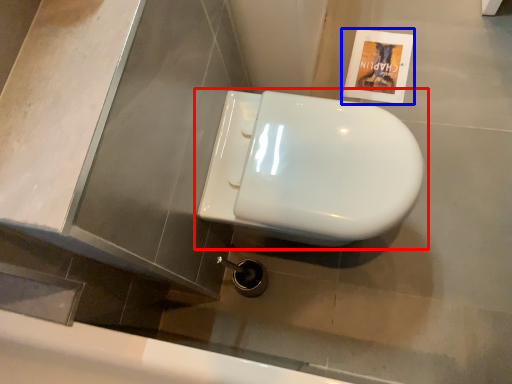
Question: Among these objects, which one is farthest to the camera, toilet (highlighted by a red box) or flyer (highlighted by a blue box)?

Choices:
 (A) toilet
 (B) flyer

Answer: (B)